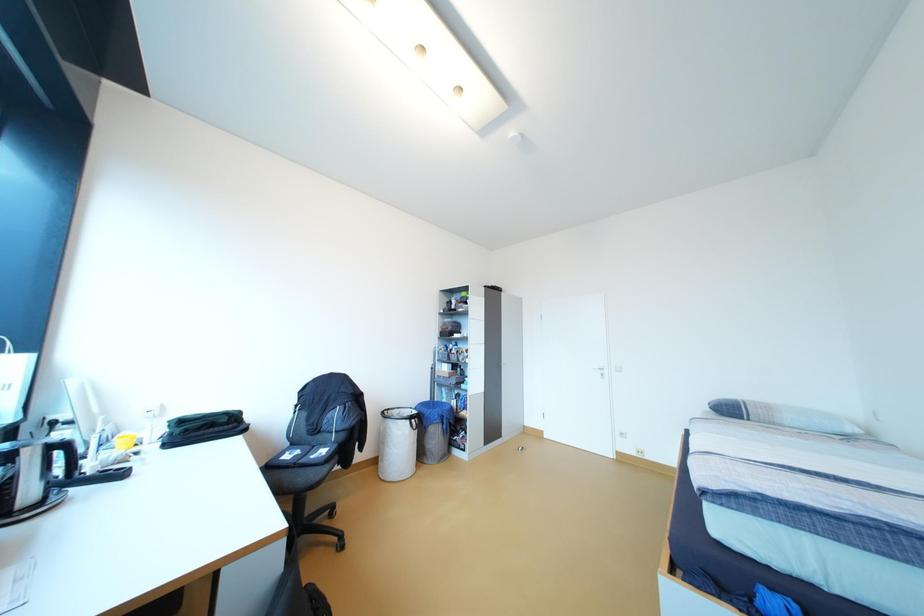
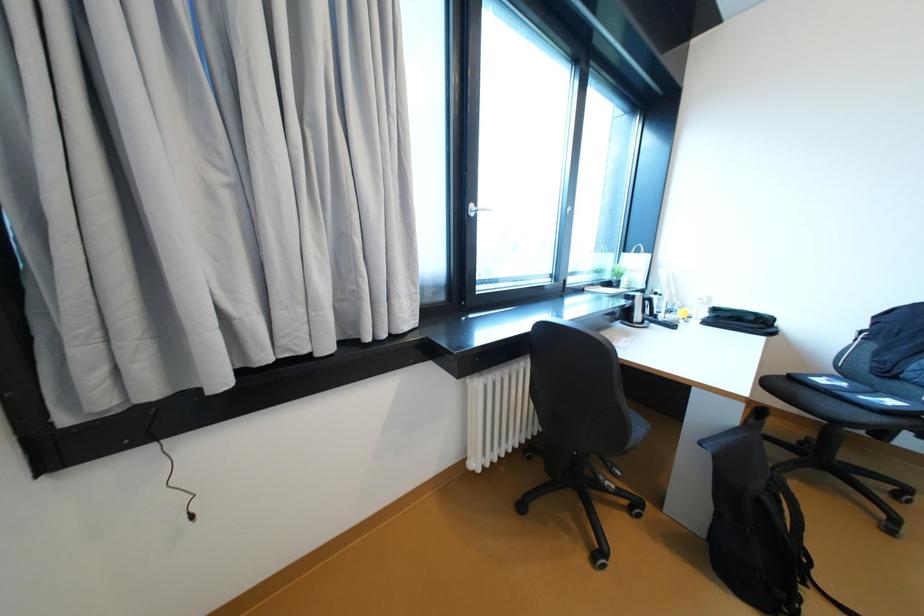
Question: Based on the continuous images, in which direction is the camera rotating? Reply with the corresponding letter.

Choices:
 (A) Left
 (B) Right
 (C) Up
 (D) Down

Answer: (A)